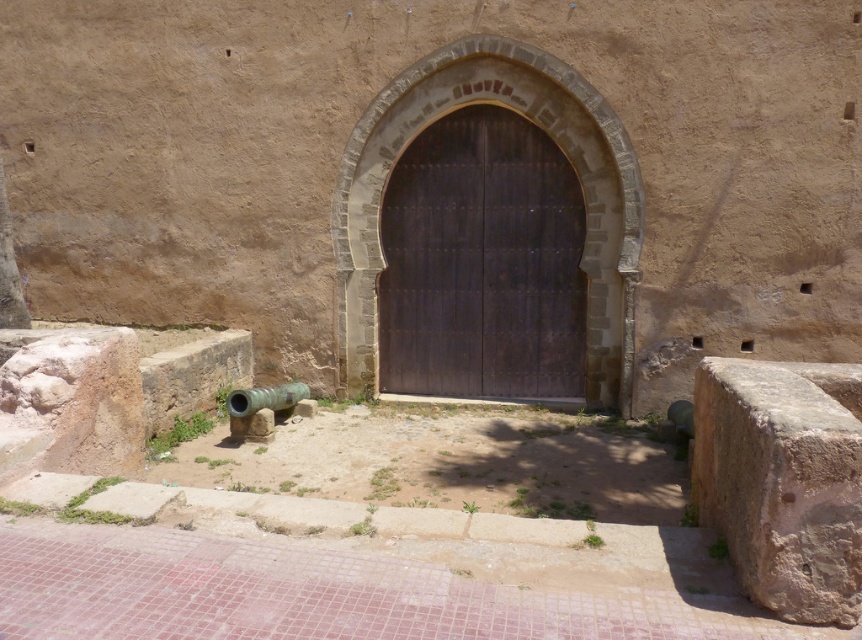
You are a historian examining the historical structure. You notice the brown rough stone at lower right and the green polished metal cannon at lower left. Which object is located to the right of the other?

The brown rough stone at lower right is positioned on the right side of green polished metal cannon at lower left.